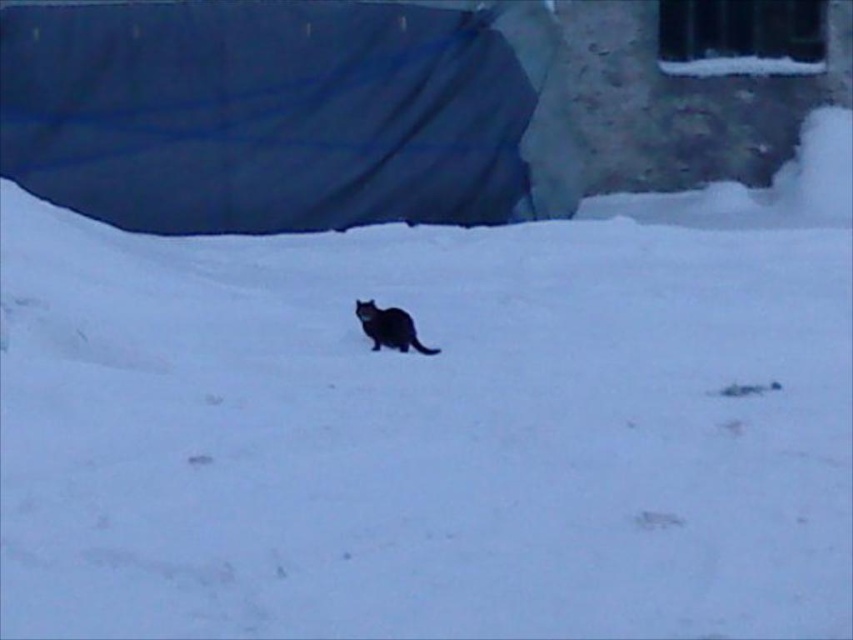
Is dark blue fabric at upper left above black fur cat at center?

Yes, dark blue fabric at upper left is above black fur cat at center.

Who is lower down, dark blue fabric at upper left or black fur cat at center?

Positioned lower is black fur cat at center.

Where is `dark blue fabric at upper left`? The width and height of the screenshot is (853, 640). dark blue fabric at upper left is located at coordinates (262, 115).

The height and width of the screenshot is (640, 853). Identify the location of dark blue fabric at upper left. (262, 115).